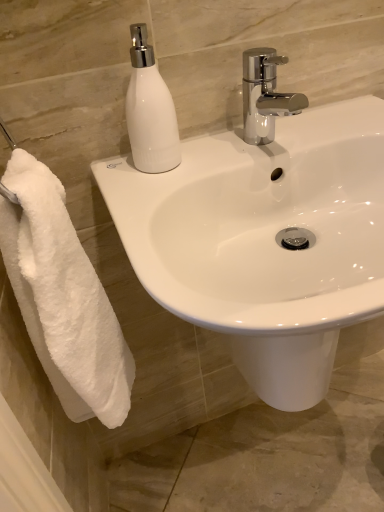
This screenshot has width=384, height=512. I want to click on vacant area that lies in front of white glossy soap dispenser at upper left, so 150,196.